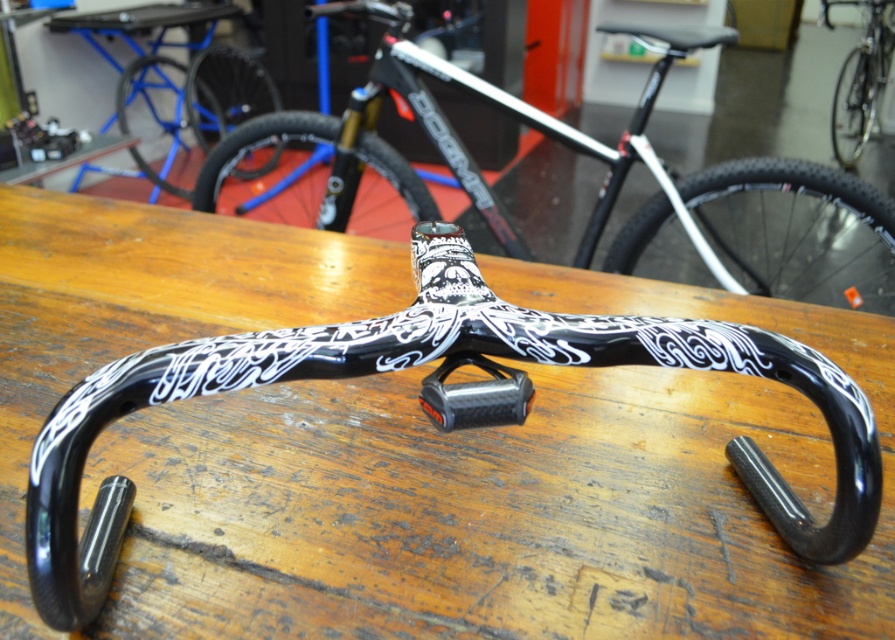
Can you confirm if black glossy bicycle handlebar at center is bigger than carbon fiber handlebar at center?

Correct, black glossy bicycle handlebar at center is larger in size than carbon fiber handlebar at center.

Which is in front, point (891, 36) or point (480, 396)?

Point (480, 396) is in front.

The height and width of the screenshot is (640, 895). Identify the location of black glossy bicycle handlebar at center. (859, 77).

I want to click on black glossy bicycle handlebar at center, so click(x=859, y=77).

Can you confirm if black matte bicycle handlebar at center is shorter than black glossy bicycle handlebar at center?

Incorrect, black matte bicycle handlebar at center's height does not fall short of black glossy bicycle handlebar at center's.

Can you confirm if black matte bicycle handlebar at center is smaller than black glossy bicycle handlebar at center?

Actually, black matte bicycle handlebar at center might be larger than black glossy bicycle handlebar at center.

Which is behind, point (584, 141) or point (885, 72)?

The point (885, 72) is more distant.

Find the location of `black matte bicycle handlebar at center`. black matte bicycle handlebar at center is located at coordinates (604, 180).

The width and height of the screenshot is (895, 640). I want to click on wooden table at center, so click(x=537, y=483).

This screenshot has width=895, height=640. What do you see at coordinates (537, 483) in the screenshot? I see `wooden table at center` at bounding box center [537, 483].

In order to click on wooden table at center in this screenshot , I will do `click(537, 483)`.